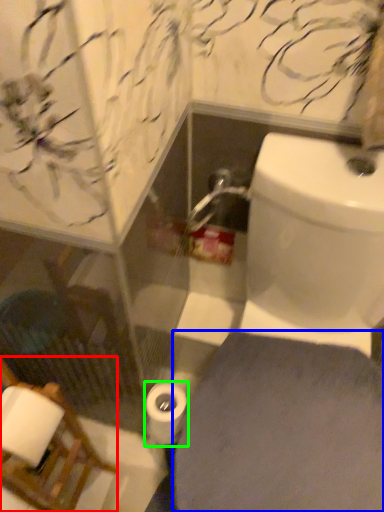
Question: Which is nearer to the chair (highlighted by a red box)? porcelain (highlighted by a blue box) or toilet paper (highlighted by a green box).

Choices:
 (A) porcelain
 (B) toilet paper

Answer: (B)